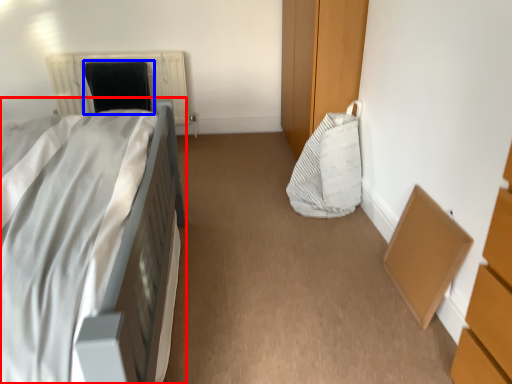
Question: Among these objects, which one is farthest to the camera, bed (highlighted by a red box) or bean bag chair (highlighted by a blue box)?

Choices:
 (A) bed
 (B) bean bag chair

Answer: (B)